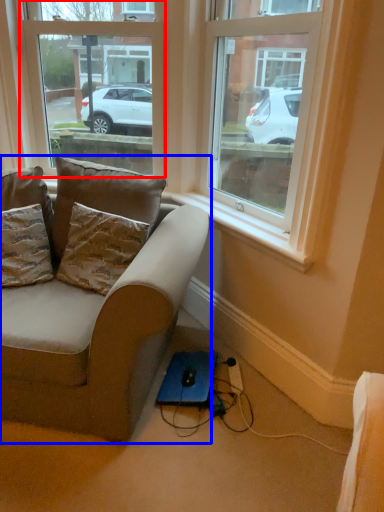
Question: Which point is further to the camera, window (highlighted by a red box) or studio couch (highlighted by a blue box)?

Choices:
 (A) window
 (B) studio couch

Answer: (A)